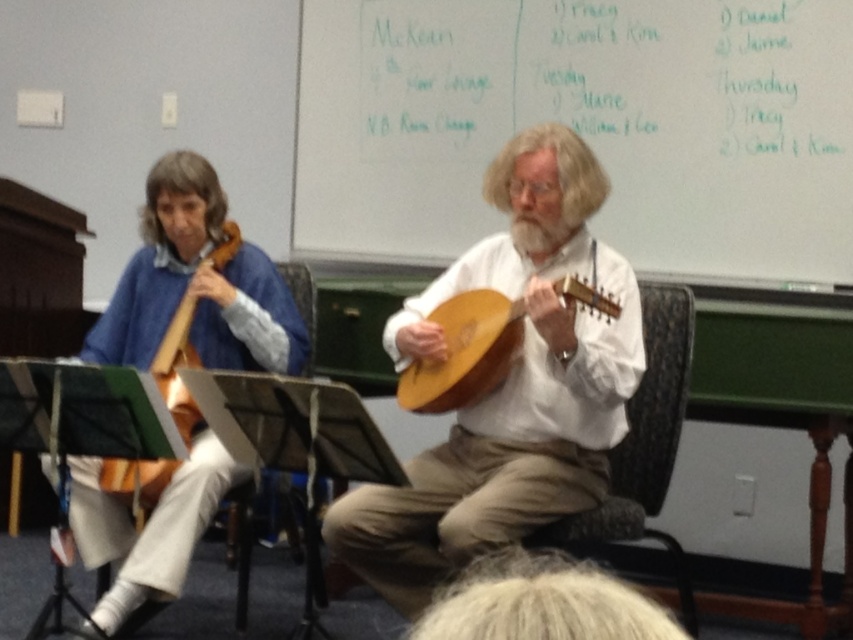
You are a photographer setting up a shot of the wooden mandolin at center and the white matte beard at center. To ensure both are in focus, you need to know their vertical positions. Which one is lower in the image?

The wooden mandolin at center is below the white matte beard at center, so it is lower in the image.

You are a photographer setting up for a group photo in the classroom. You need to ensure that the wooden mandolin at center and the white matte beard at center are both visible in the frame. Given their height difference, which object should you adjust the camera angle to focus on first to ensure both are in view?

The wooden mandolin at center is taller than the white matte beard at center. To ensure both are visible, adjust the camera angle to focus on the wooden mandolin at center first, then frame the shot so the shorter white matte beard at center is also in view.